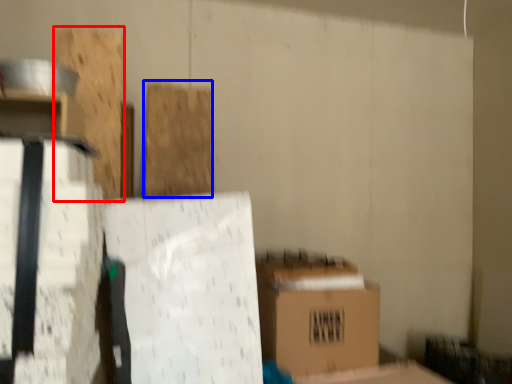
Question: Which of the following is the farthest to the observer, wood (highlighted by a red box) or wood (highlighted by a blue box)?

Choices:
 (A) wood
 (B) wood

Answer: (B)